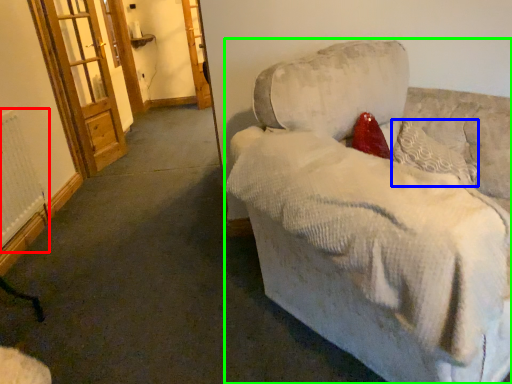
Question: Considering the real-world distances, which object is farthest from radiator (highlighted by a red box)? pillow (highlighted by a blue box) or studio couch (highlighted by a green box)?

Choices:
 (A) pillow
 (B) studio couch

Answer: (A)